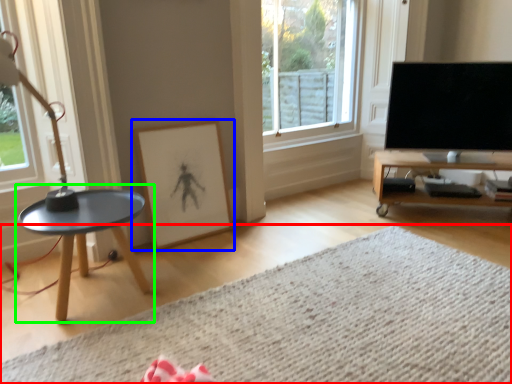
Question: Which is farther away from plain (highlighted by a red box)? picture frame (highlighted by a blue box) or coffee table (highlighted by a green box)?

Choices:
 (A) picture frame
 (B) coffee table

Answer: (A)